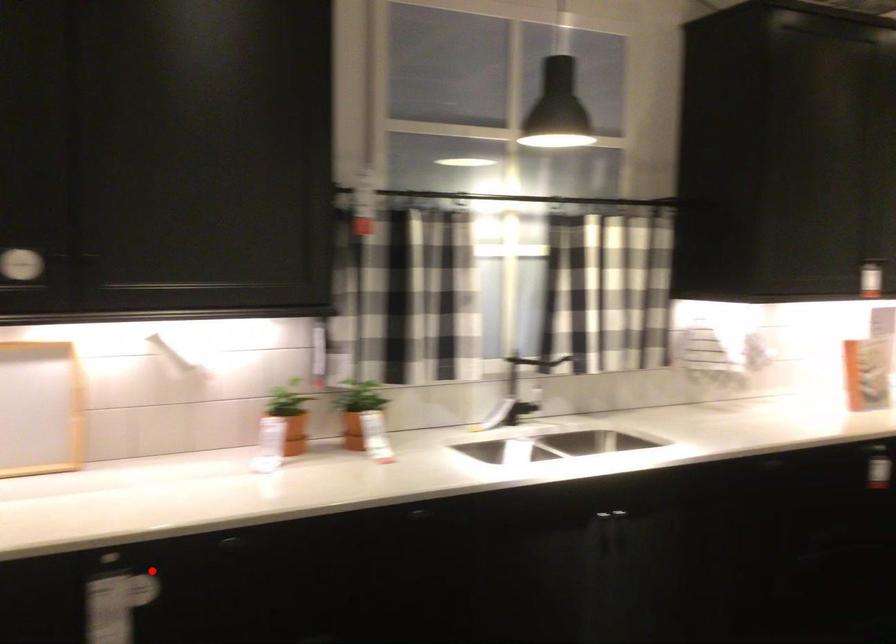
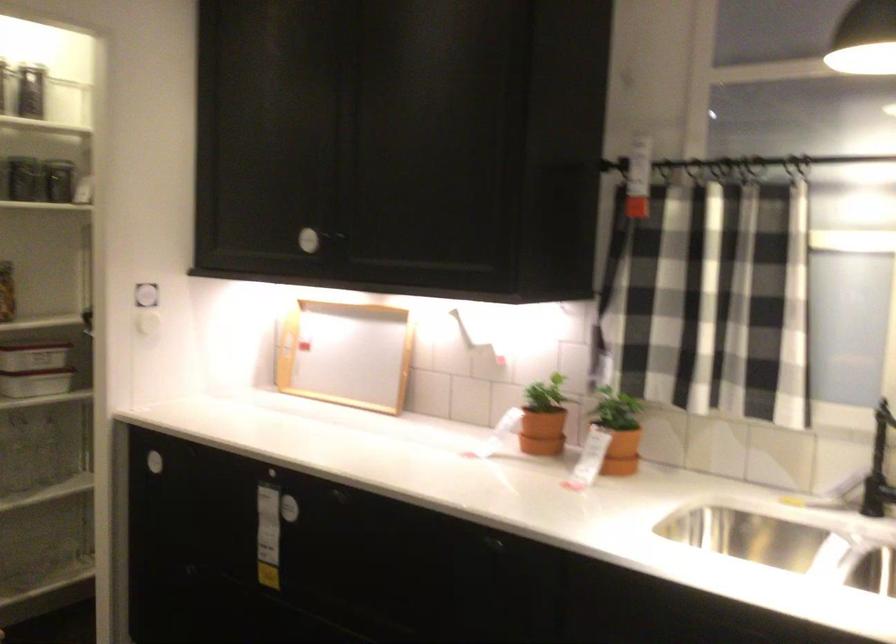
Where in the second image is the point corresponding to the highlighted location from the first image?

(306, 500)